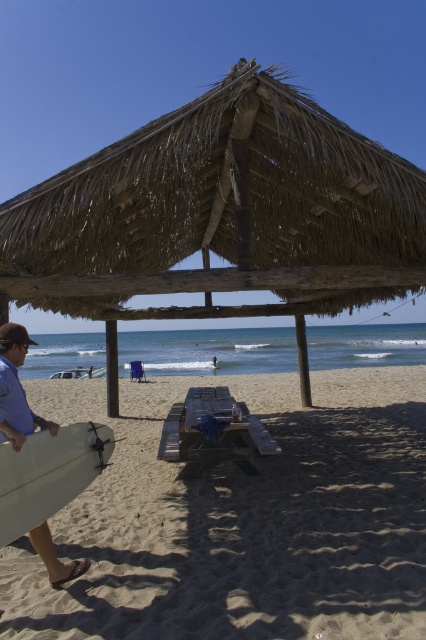
You are standing on the sandy beach at lower left and want to see the thatched straw hut at center. Can you see it clearly from your current position?

The sandy beach at lower left is much taller than thatched straw hut at center, so you might not be able to see it clearly due to the elevation difference.

You are planning to place a small potted plant on the wooden picnic table at center. Considering the height of the white foam surfboard at left, will the plant be visible from the side where the surfboard is placed?

The wooden picnic table at center has a lesser height compared to white foam surfboard at left, so the plant placed on the table might be partially or fully obscured by the surfboard from that side.